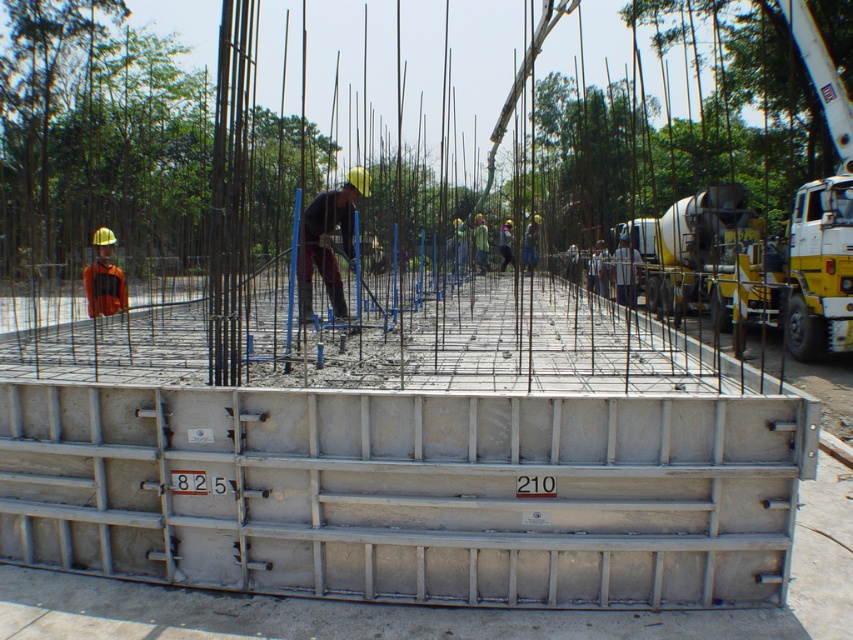
You are a safety inspector evaluating the visibility of workers on a construction site. You notice a matte black helmet at center and an orange reflective vest at left. Which worker is harder to see from a distance?

The matte black helmet at center is harder to see from a distance because it occupies less space than the orange reflective vest at left, making it less visible against the construction site background.

You are a construction inspector standing at the edge of the silver metallic foundation at center. You need to check the distance between the formwork marked with numbers and the nearest worker. Can you reach the nearest worker without stepping off the foundation?

The distance between the silver metallic foundation at center and the nearest worker is 3.66 meters. Since you are standing on the foundation, you would need to step off to reach the worker, so you cannot reach them without leaving the foundation.